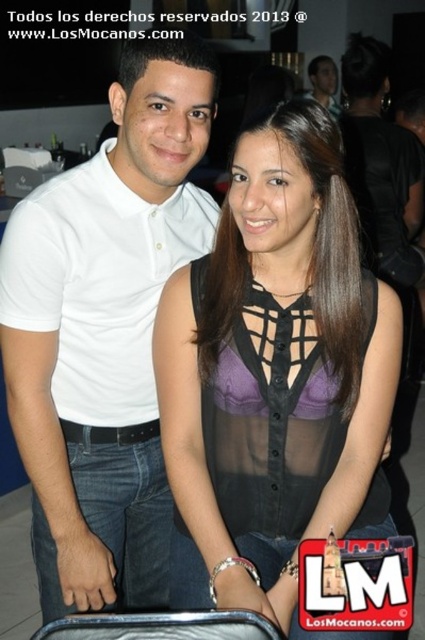
Is sheer black blouse at center positioned behind matte black shirt at upper center?

No, sheer black blouse at center is in front of matte black shirt at upper center.

Which is in front, point (314, 266) or point (334, 92)?

Point (314, 266) is in front.

Does point (300, 177) lie behind point (314, 72)?

No, it is not.

The height and width of the screenshot is (640, 425). I want to click on sheer black blouse at center, so click(x=275, y=376).

Does white cotton polo shirt at center have a greater height compared to matte black shirt at upper center?

Correct, white cotton polo shirt at center is much taller as matte black shirt at upper center.

Which of these two, white cotton polo shirt at center or matte black shirt at upper center, stands taller?

Standing taller between the two is white cotton polo shirt at center.

The height and width of the screenshot is (640, 425). Describe the element at coordinates (104, 330) in the screenshot. I see `white cotton polo shirt at center` at that location.

Where is `white cotton polo shirt at center`? white cotton polo shirt at center is located at coordinates (104, 330).

Who is positioned more to the left, sheer black blouse at center or white cotton polo shirt at center?

From the viewer's perspective, white cotton polo shirt at center appears more on the left side.

From the picture: Is sheer black blouse at center to the right of white cotton polo shirt at center from the viewer's perspective?

Yes, sheer black blouse at center is to the right of white cotton polo shirt at center.

Is point (283, 328) positioned before point (135, 253)?

Yes, point (283, 328) is in front of point (135, 253).

Where is `sheer black blouse at center`? sheer black blouse at center is located at coordinates (275, 376).